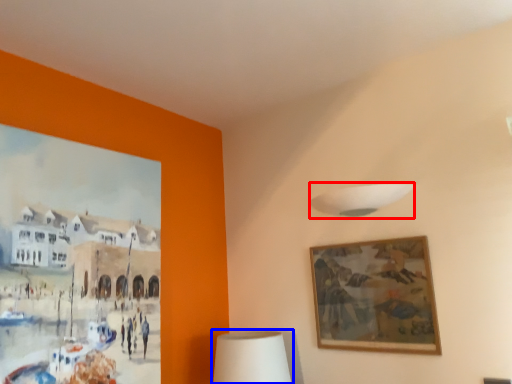
Question: Which object is closer to the camera taking this photo, lamp (highlighted by a red box) or table lamp (highlighted by a blue box)?

Choices:
 (A) lamp
 (B) table lamp

Answer: (A)